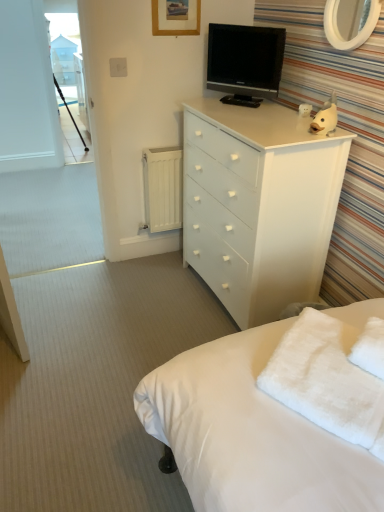
The height and width of the screenshot is (512, 384). I want to click on vacant space underneath white painted metal radiator at lower left (from a real-world perspective), so click(165, 252).